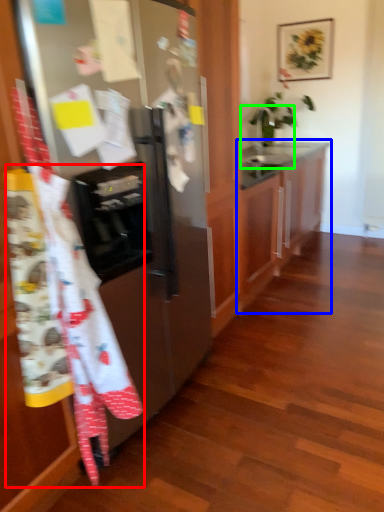
Question: Estimate the real-world distances between objects in this image. Which object is closer to blanket (highlighted by a red box), cabinetry (highlighted by a blue box) or sink (highlighted by a green box)?

Choices:
 (A) cabinetry
 (B) sink

Answer: (A)